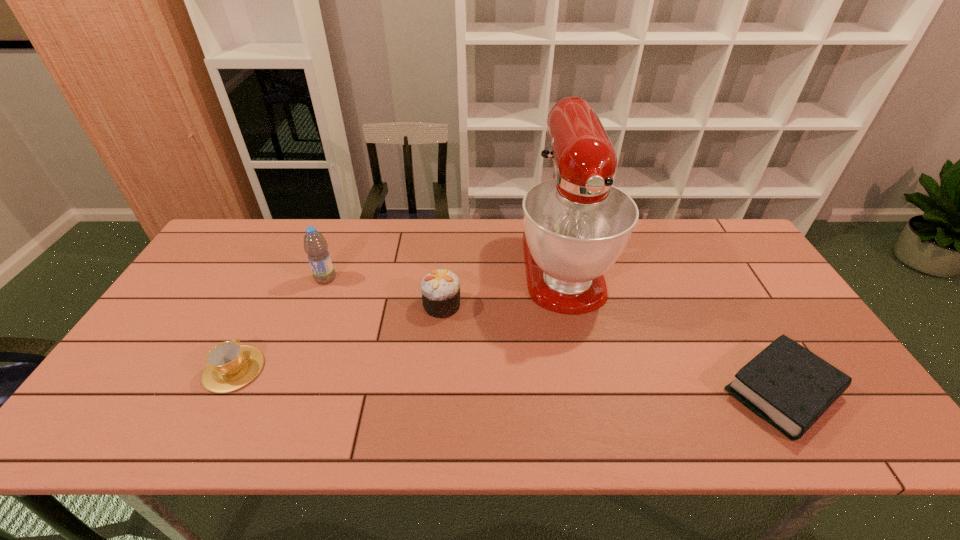
Where is `vacant space located 0.300m on the left of the cupcake`? The image size is (960, 540). vacant space located 0.300m on the left of the cupcake is located at coordinates (318, 305).

Image resolution: width=960 pixels, height=540 pixels. I want to click on vacant space located 0.100m with the handle on the side of the cup, so click(x=259, y=319).

What are the coordinates of `free space located 0.280m with the handle on the side of the cup` in the screenshot? It's located at (281, 275).

Locate an element on the screen. vacant space located with the handle on the side of the cup is located at coordinates (278, 280).

The image size is (960, 540). I want to click on vacant space positioned on the back of the rightmost object, so click(703, 256).

Locate an element on the screen. object that is at the far edge is located at coordinates pos(576,225).

Image resolution: width=960 pixels, height=540 pixels. What are the coordinates of `object present at the near edge` in the screenshot? It's located at (787, 385).

The height and width of the screenshot is (540, 960). I want to click on object present at the right edge, so click(x=787, y=385).

Where is `object that is at the near right corner`? object that is at the near right corner is located at coordinates (787, 385).

Identify the location of vacant region at the far edge of the desktop. The image size is (960, 540). (440, 233).